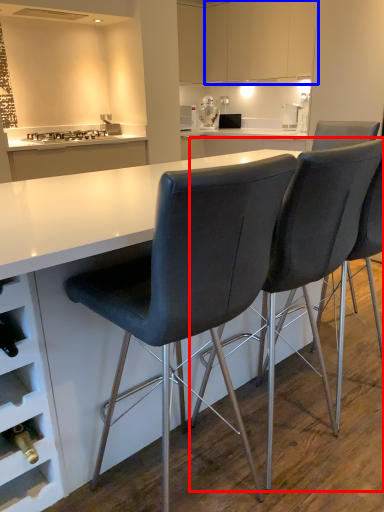
Question: Which of the following is the closest to the observer, chair (highlighted by a red box) or cabinetry (highlighted by a blue box)?

Choices:
 (A) chair
 (B) cabinetry

Answer: (A)